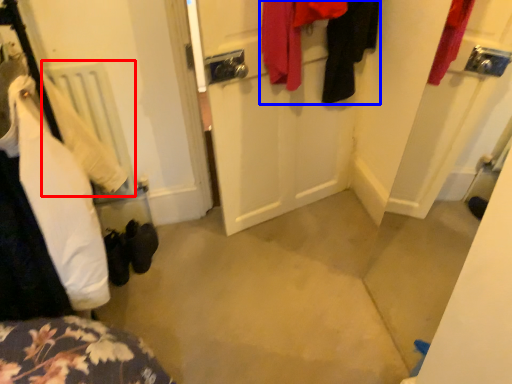
Question: Which point is closer to the camera, radiator (highlighted by a red box) or clothing (highlighted by a blue box)?

Choices:
 (A) radiator
 (B) clothing

Answer: (B)